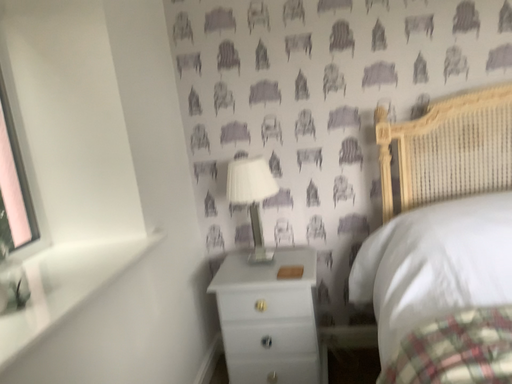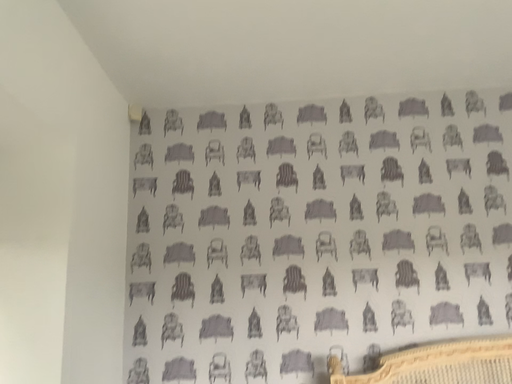
Question: How did the camera likely rotate when shooting the video?

Choices:
 (A) rotated left
 (B) rotated right

Answer: (B)